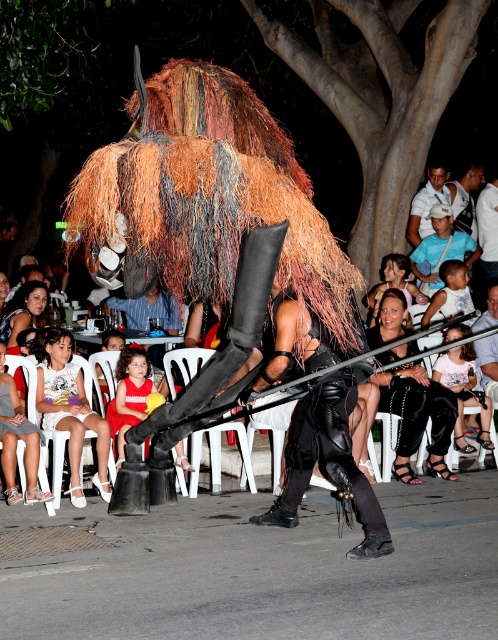
Does red satin dress at center appear on the left side of shiny gold armor at center?

In fact, red satin dress at center is to the right of shiny gold armor at center.

Which of these two, red satin dress at center or shiny gold armor at center, stands taller?

red satin dress at center

Describe the element at coordinates (128, 396) in the screenshot. I see `red satin dress at center` at that location.

Identify the location of red satin dress at center. (128, 396).

Is white fabric dress at lower left positioned at the back of red satin dress at center?

No, it is not.

Is white fabric dress at lower left bigger than red satin dress at center?

Yes.

Measure the distance between point (35, 346) and camera.

They are 8.29 meters apart.

The image size is (498, 640). I want to click on white fabric dress at lower left, so click(70, 408).

Between white fabric dress at lower left and matte black dress at center, which one is positioned lower?

Positioned lower is white fabric dress at lower left.

Is point (51, 388) closer to camera compared to point (38, 282)?

Yes.

This screenshot has height=640, width=498. I want to click on white fabric dress at lower left, so click(70, 408).